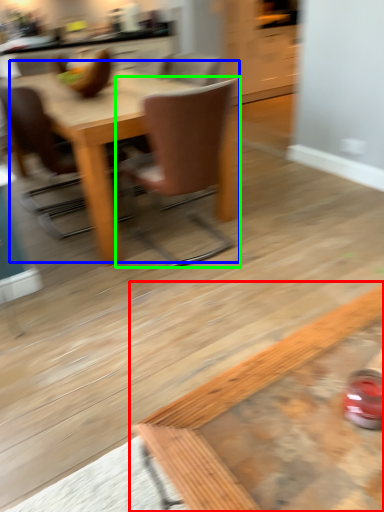
Question: Which is nearer to the coffee table (highlighted by a red box)? kitchen & dining room table (highlighted by a blue box) or chair (highlighted by a green box).

Choices:
 (A) kitchen & dining room table
 (B) chair

Answer: (B)